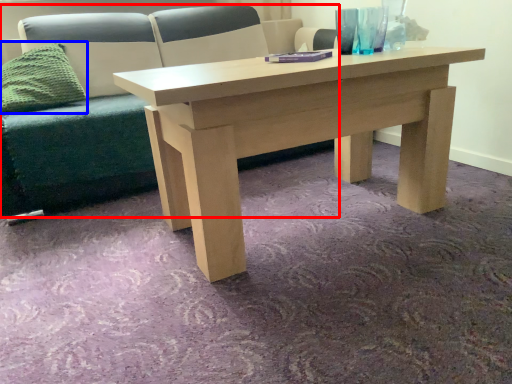
Question: Which object appears farthest to the camera in this image, studio couch (highlighted by a red box) or pillow (highlighted by a blue box)?

Choices:
 (A) studio couch
 (B) pillow

Answer: (B)